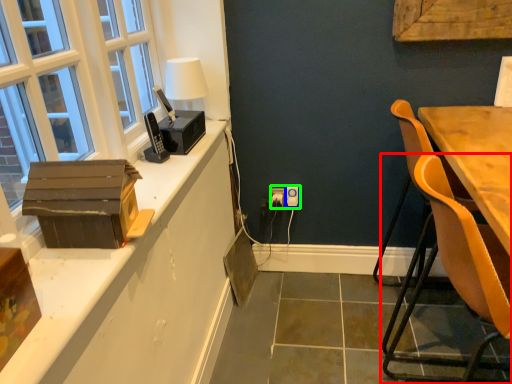
Question: Considering the real-world distances, which object is closest to chair (highlighted by a red box)? power outlet (highlighted by a blue box) or electric outlet (highlighted by a green box).

Choices:
 (A) power outlet
 (B) electric outlet

Answer: (B)